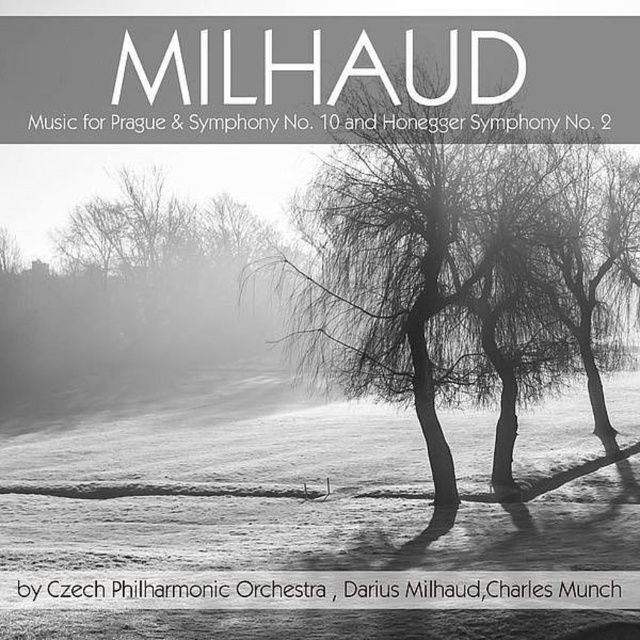
Consider the image. You are an album cover designer who wants to highlight the contrast between the white powder snow at center and the smooth bark tree at center in the winter landscape. Which one is shorter?

The white powder snow at center is not as tall as the smooth bark tree at center, so the white powder snow at center is shorter.